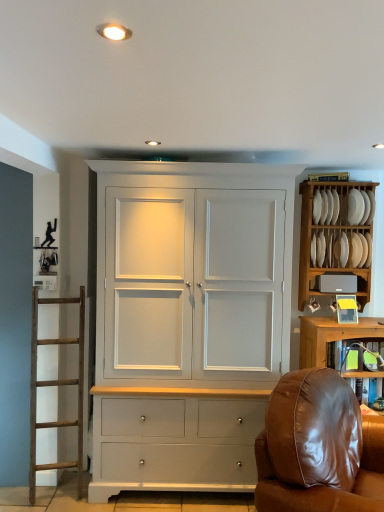
Image resolution: width=384 pixels, height=512 pixels. I want to click on white matte plate at upper right, the first plate viewed from the right, so click(x=355, y=207).

The width and height of the screenshot is (384, 512). What do you see at coordinates (328, 240) in the screenshot?
I see `white wood plate rack at upper right` at bounding box center [328, 240].

You are a GUI agent. You are given a task and a screenshot of the screen. Output one action in this format:
    pyautogui.click(x=<x>, y=<y>)
    Task: Click on the white painted wood cupboard at center
    This screenshot has height=512, width=384.
    Given the screenshot: What is the action you would take?
    pyautogui.click(x=188, y=321)

This screenshot has width=384, height=512. What do you see at coordinates (317, 448) in the screenshot?
I see `brown leather chair at lower right` at bounding box center [317, 448].

The height and width of the screenshot is (512, 384). What are the coordinates of `white matte plate at upper right, the second plate in the left-to-right sequence` in the screenshot? It's located at (355, 207).

Is matte white light fixture at upper center turned away from white wood plate rack at upper right?

No, matte white light fixture at upper center's orientation is not away from white wood plate rack at upper right.

From the picture: Which point is more distant from viewer, (105,37) or (366,267)?

The point (366,267) is behind.

Considering their positions, is matte white light fixture at upper center located in front of or behind white wood plate rack at upper right?

In the image, matte white light fixture at upper center appears in front of white wood plate rack at upper right.

How much distance is there between matte white light fixture at upper center and white wood plate rack at upper right?

matte white light fixture at upper center and white wood plate rack at upper right are 7.61 feet apart from each other.

Is point (329, 450) less distant than point (118, 29)?

No, (329, 450) is further to viewer.

In the scene shown: Is brown leather chair at lower right facing towards matte white light fixture at upper center?

No.

Which is in front, brown leather chair at lower right or matte white light fixture at upper center?

Positioned in front is matte white light fixture at upper center.

Is brown leather chair at lower right thinner than matte white light fixture at upper center?

No.

From the image's perspective, is matte white light fixture at upper center beneath white painted wood cupboard at center?

Incorrect, from the image's perspective, matte white light fixture at upper center is higher than white painted wood cupboard at center.

In the scene shown: Are matte white light fixture at upper center and white painted wood cupboard at center located far from each other?

Yes, matte white light fixture at upper center is far from white painted wood cupboard at center.

Based on the photo, is white painted wood cupboard at center inside matte white light fixture at upper center?

No, white painted wood cupboard at center is not inside matte white light fixture at upper center.

From the picture: Which of these two, matte white light fixture at upper center or white painted wood cupboard at center, is wider?

white painted wood cupboard at center is wider.

Is white wood plate rack at upper right positioned far away from brown leather chair at lower right?

Yes, white wood plate rack at upper right is far from brown leather chair at lower right.

From a real-world perspective, is white wood plate rack at upper right below brown leather chair at lower right?

No, from a real-world perspective, white wood plate rack at upper right is not below brown leather chair at lower right.

Can you confirm if white wood plate rack at upper right is wider than brown leather chair at lower right?

In fact, white wood plate rack at upper right might be narrower than brown leather chair at lower right.

Considering their positions, is white wood plate rack at upper right located in front of or behind brown leather chair at lower right?

white wood plate rack at upper right is behind brown leather chair at lower right.

Is white painted wood cupboard at center turned away from matte white light fixture at upper center?

No, white painted wood cupboard at center is not facing the opposite direction of matte white light fixture at upper center.

Considering the relative positions of white painted wood cupboard at center and matte white light fixture at upper center in the image provided, is white painted wood cupboard at center behind matte white light fixture at upper center?

Yes, the depth of white painted wood cupboard at center is greater than that of matte white light fixture at upper center.

From a real-world perspective, does white painted wood cupboard at center sit lower than matte white light fixture at upper center?

Indeed, from a real-world perspective, white painted wood cupboard at center is positioned beneath matte white light fixture at upper center.

How many degrees apart are the facing directions of white painted wood cupboard at center and matte white light fixture at upper center?

The facing directions of white painted wood cupboard at center and matte white light fixture at upper center are 176 degrees apart.

Which of these two, white glossy plate at upper right, which is the second plate in right-to-left order, or matte gray speaker at upper right, stands shorter?

With less height is matte gray speaker at upper right.

Does white glossy plate at upper right, which is the second plate in right-to-left order, turn towards matte gray speaker at upper right?

No, white glossy plate at upper right, which is the second plate in right-to-left order, does not turn towards matte gray speaker at upper right.

Where is `plate on the left of matte gray speaker at upper right`? Image resolution: width=384 pixels, height=512 pixels. plate on the left of matte gray speaker at upper right is located at coordinates (326, 206).

Can you confirm if white glossy plate at upper right, which is the second plate in right-to-left order, is bigger than matte gray speaker at upper right?

No, white glossy plate at upper right, which is the second plate in right-to-left order, is not bigger than matte gray speaker at upper right.

In the scene shown: Is white painted wood cupboard at center not close to white glossy plate at upper right, arranged as the first plate when viewed from the left?

Yes, white painted wood cupboard at center and white glossy plate at upper right, arranged as the first plate when viewed from the left, are quite far apart.

Can you confirm if white painted wood cupboard at center is shorter than white glossy plate at upper right, arranged as the first plate when viewed from the left?

Incorrect, the height of white painted wood cupboard at center does not fall short of that of white glossy plate at upper right, arranged as the first plate when viewed from the left.

Who is bigger, white painted wood cupboard at center or white glossy plate at upper right, arranged as the first plate when viewed from the left?

Bigger between the two is white painted wood cupboard at center.

Does point (157, 438) lie in front of point (321, 211)?

Yes, point (157, 438) is closer to viewer.

The height and width of the screenshot is (512, 384). Find the location of `lighting that appears in front of the white wood plate rack at upper right`. lighting that appears in front of the white wood plate rack at upper right is located at coordinates (113, 31).

Locate an element on the screen. The height and width of the screenshot is (512, 384). chair located below the matte white light fixture at upper center (from the image's perspective) is located at coordinates (317, 448).

From the image, which object appears to be farther from white wood plate rack at upper right, white painted wood cupboard at center or matte gray speaker at upper right?

white painted wood cupboard at center is positioned further to the anchor white wood plate rack at upper right.

Estimate the real-world distances between objects in this image. Which object is further from matte white light fixture at upper center, matte gray speaker at upper right or white glossy plate at upper right, arranged as the first plate when viewed from the left?

matte gray speaker at upper right lies further to matte white light fixture at upper center than the other object.

Which object lies nearer to the anchor point white wood plate rack at upper right, white matte plate at upper right, the first plate viewed from the right, or brown leather chair at lower right?

Based on the image, white matte plate at upper right, the first plate viewed from the right, appears to be nearer to white wood plate rack at upper right.

Estimate the real-world distances between objects in this image. Which object is closer to matte white light fixture at upper center, white matte plate at upper right, the first plate viewed from the right, or white glossy plate at upper right, which is the second plate in right-to-left order?

Among the two, white glossy plate at upper right, which is the second plate in right-to-left order, is located nearer to matte white light fixture at upper center.

Looking at the image, which one is located further to white glossy plate at upper right, arranged as the first plate when viewed from the left, white matte plate at upper right, the first plate viewed from the right, or brown leather chair at lower right?

The object further to white glossy plate at upper right, arranged as the first plate when viewed from the left, is brown leather chair at lower right.

Considering their positions, is brown leather chair at lower right positioned further to white painted wood cupboard at center than white glossy plate at upper right, arranged as the first plate when viewed from the left?

Based on the image, white glossy plate at upper right, arranged as the first plate when viewed from the left, appears to be further to white painted wood cupboard at center.

Based on their spatial positions, is matte white light fixture at upper center or white glossy plate at upper right, which is the second plate in right-to-left order, further from matte gray speaker at upper right?

matte white light fixture at upper center is further to matte gray speaker at upper right.

When comparing their distances from brown leather chair at lower right, does matte white light fixture at upper center or white matte plate at upper right, the first plate viewed from the right, seem further?

Among the two, matte white light fixture at upper center is located further to brown leather chair at lower right.

You are a GUI agent. You are given a task and a screenshot of the screen. Output one action in this format:
    pyautogui.click(x=<x>, y=<y>)
    Task: Click on the chair between matte white light fixture at upper center and white matte plate at upper right, the first plate viewed from the right, from front to back
    
    Given the screenshot: What is the action you would take?
    pyautogui.click(x=317, y=448)

Find the location of a particular element. plate between white painted wood cupboard at center and matte gray speaker at upper right from left to right is located at coordinates (326, 206).

Identify the location of plate located between matte white light fixture at upper center and white glossy plate at upper right, arranged as the first plate when viewed from the left, in the depth direction. The width and height of the screenshot is (384, 512). (355, 207).

The image size is (384, 512). I want to click on cupboard positioned between matte white light fixture at upper center and white glossy plate at upper right, arranged as the first plate when viewed from the left, from near to far, so click(188, 321).